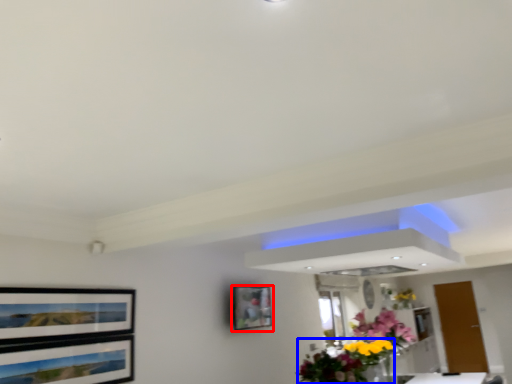
Question: Which object appears farthest to the camera in this image, picture frame (highlighted by a red box) or floral arrangement (highlighted by a blue box)?

Choices:
 (A) picture frame
 (B) floral arrangement

Answer: (A)